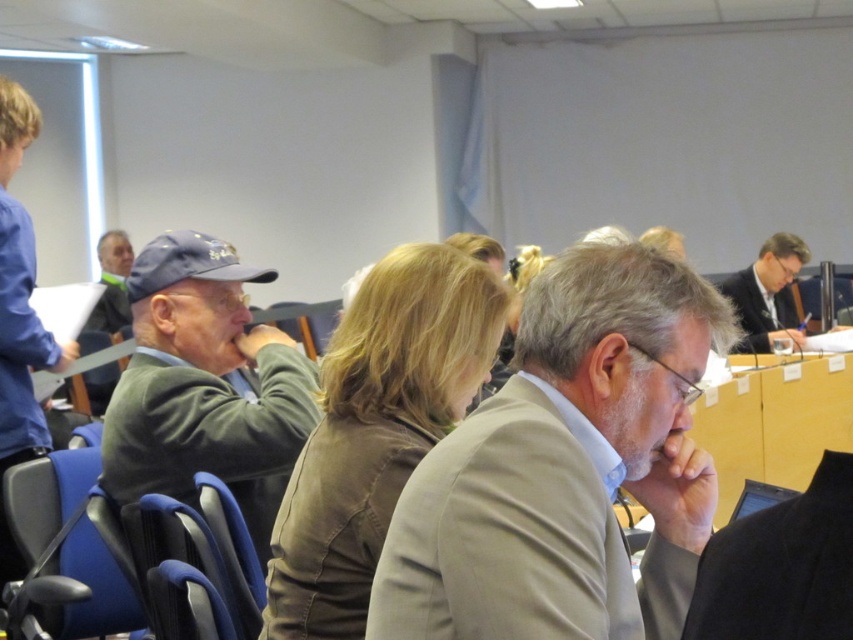
You are a photographer standing in the conference room and want to take a photo of both the green wool sweater at left and the matte gray cap at upper left. The camera you are using has a maximum focus range of 3 meters. Will you be able to capture both objects in focus without moving the camera?

The green wool sweater at left is 3.75 meters away from the matte gray cap at upper left. Since the camera can only focus up to 3 meters, the distance between them exceeds the camera range. Therefore, you cannot capture both in focus without moving the camera.

You are organizing a photo shoot and need to ensure that the light beige suit at center and the matte gray cap at upper left are both visible in the frame. Given their sizes, which object might require more careful positioning to avoid being obscured?

The light beige suit at center occupies less space than the matte gray cap at upper left, so it might require more careful positioning to avoid being obscured because it is smaller and could be easily missed in the frame.

You are standing in the conference room and want to place a small potted plant between the two points labeled point (427,588) and point (131,248). Which point should the plant be closer to in order to be nearer to the people sitting in the foreground?

The plant should be closer to point (427,588) because it is nearer to the viewer compared to point (131,248).